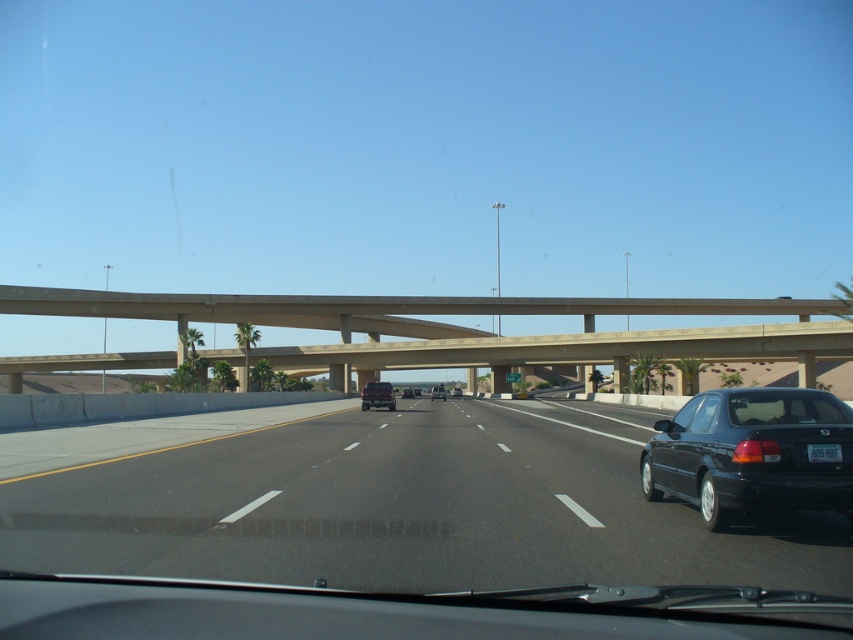
Question: Which point is farther from the camera taking this photo?

Choices:
 (A) (785, 406)
 (B) (666, 458)
 (C) (839, 445)

Answer: (B)

Question: Does concrete bridge at center have a larger size compared to black matte sedan at right?

Choices:
 (A) no
 (B) yes

Answer: (B)

Question: Which object appears closest to the camera in this image?

Choices:
 (A) matte black suv at center
 (B) matte black sedan at center
 (C) black asphalt highway at center

Answer: (C)

Question: Is black asphalt highway at center closer to camera compared to black matte sedan at right?

Choices:
 (A) yes
 (B) no

Answer: (A)

Question: Does matte black sedan at center appear on the left side of black matte suv at center?

Choices:
 (A) yes
 (B) no

Answer: (A)

Question: Which of the following is the farthest from the observer?

Choices:
 (A) black matte sedan at right
 (B) black asphalt highway at center
 (C) white plastic license plate at center
 (D) transparent glass windshield at center

Answer: (D)